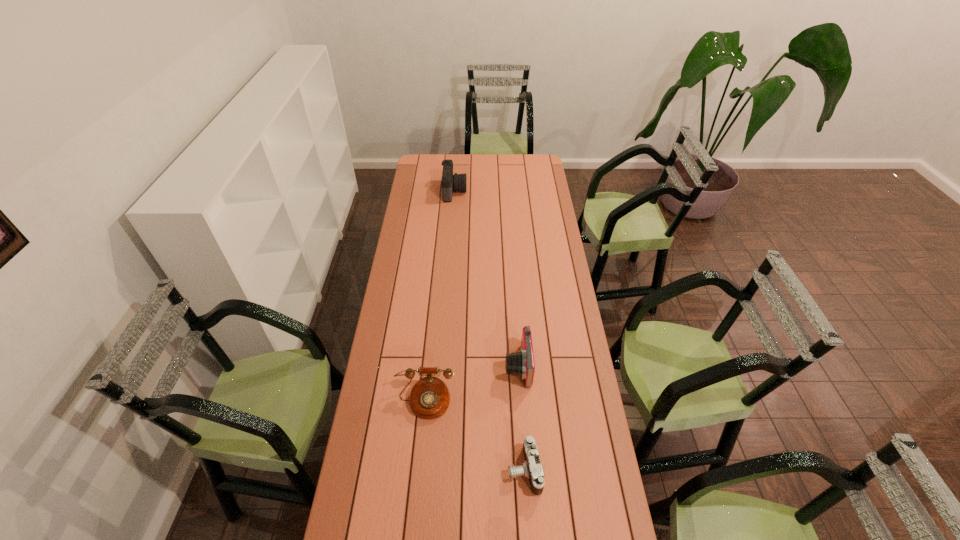
Identify which camera is the second closest to the farthest camera. Please provide its 2D coordinates. Your answer should be formatted as a tuple, i.e. [(x, y)], where the tuple contains the x and y coordinates of a point satisfying the conditions above.

[(531, 468)]

You are a GUI agent. You are given a task and a screenshot of the screen. Output one action in this format:
    pyautogui.click(x=<x>, y=<y>)
    Task: Click on the vacant area in the image that satisfies the following two spatial constraints: 1. on the front-facing side of the second tallest camera; 2. on the dial of the telephone
    
    Given the screenshot: What is the action you would take?
    pyautogui.click(x=520, y=401)

Find the location of a particular element. This screenshot has width=960, height=540. vacant space that satisfies the following two spatial constraints: 1. on the front-facing side of the second tallest camera; 2. on the dial of the telephone is located at coordinates (520, 401).

You are a GUI agent. You are given a task and a screenshot of the screen. Output one action in this format:
    pyautogui.click(x=<x>, y=<y>)
    Task: Click on the vacant space that satisfies the following two spatial constraints: 1. on the front-facing side of the second tallest camera; 2. on the dial of the telephone
    The height and width of the screenshot is (540, 960).
    Given the screenshot: What is the action you would take?
    pyautogui.click(x=520, y=401)